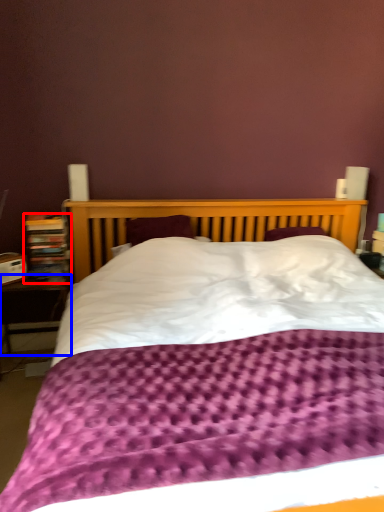
Question: Which point is closer to the camera, bookcase (highlighted by a red box) or table (highlighted by a blue box)?

Choices:
 (A) bookcase
 (B) table

Answer: (B)